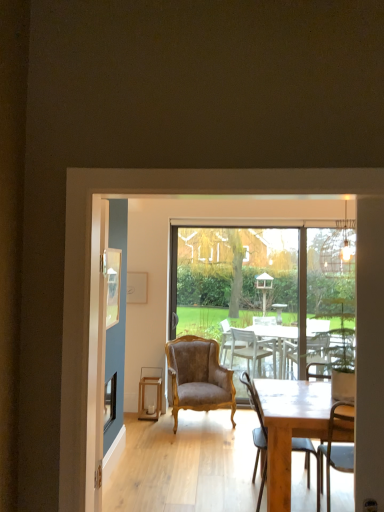
Where is `brown velvet armchair at center, the 2th chair viewed from the right`? The width and height of the screenshot is (384, 512). brown velvet armchair at center, the 2th chair viewed from the right is located at coordinates (198, 377).

The height and width of the screenshot is (512, 384). What do you see at coordinates (266, 290) in the screenshot?
I see `transparent glass window screen at center` at bounding box center [266, 290].

Image resolution: width=384 pixels, height=512 pixels. What do you see at coordinates (145, 389) in the screenshot? I see `wooden stool at center` at bounding box center [145, 389].

The height and width of the screenshot is (512, 384). What do you see at coordinates (112, 284) in the screenshot? I see `wooden picture frame at upper left` at bounding box center [112, 284].

The width and height of the screenshot is (384, 512). I want to click on wooden chair at center, which appears as the 1th chair when viewed from the right, so (x=257, y=431).

I want to click on wooden table at center, so click(x=289, y=428).

Is transparent glass screen door at center aimed at transparent glass window screen at center?

Yes, transparent glass screen door at center is facing transparent glass window screen at center.

Is transparent glass screen door at center wider than transparent glass window screen at center?

No.

Considering the sizes of transparent glass screen door at center and transparent glass window screen at center in the image, is transparent glass screen door at center bigger or smaller than transparent glass window screen at center?

In the image, transparent glass screen door at center appears to be smaller than transparent glass window screen at center.

From the image's perspective, is transparent glass screen door at center over transparent glass window screen at center?

Yes, from the image's perspective, transparent glass screen door at center is on top of transparent glass window screen at center.

Is wooden table at center turned away from transparent glass window screen at center?

That's not correct — wooden table at center is not looking away from transparent glass window screen at center.

Looking at this image, is wooden table at center located outside transparent glass window screen at center?

Yes.

How far apart are wooden table at center and transparent glass window screen at center?

They are 1.42 meters apart.

In the image, is wooden table at center positioned in front of or behind transparent glass window screen at center?

wooden table at center is in front of transparent glass window screen at center.

From the image's perspective, who appears lower, wooden picture frame at upper left or wooden stool at center?

wooden stool at center.

Is wooden picture frame at upper left wider or thinner than wooden stool at center?

Clearly, wooden picture frame at upper left has less width compared to wooden stool at center.

Is point (106, 321) farther from viewer compared to point (154, 368)?

No, (106, 321) is closer to viewer.

What are the coordinates of `picture frame above the wooden stool at center (from a real-world perspective)` in the screenshot? It's located at (112, 284).

Could you tell me if wooden stool at center is facing wooden picture frame at upper left?

No, wooden stool at center is not facing towards wooden picture frame at upper left.

Which of these two, wooden stool at center or wooden picture frame at upper left, is thinner?

wooden picture frame at upper left.

Based on the photo, is wooden picture frame at upper left to the left of brown velvet armchair at center, the 1th chair in the left-to-right sequence, from the viewer's perspective?

Indeed, wooden picture frame at upper left is positioned on the left side of brown velvet armchair at center, the 1th chair in the left-to-right sequence.

Is wooden picture frame at upper left looking in the opposite direction of brown velvet armchair at center, the 2th chair viewed from the right?

wooden picture frame at upper left does not have its back to brown velvet armchair at center, the 2th chair viewed from the right.

From the image's perspective, which is above, wooden picture frame at upper left or brown velvet armchair at center, the 2th chair viewed from the right?

wooden picture frame at upper left, from the image's perspective.

From a real-world perspective, which object rests below the other?

From a 3D spatial view, wooden stool at center is below.

Which of these two, transparent glass window screen at center or wooden stool at center, is thinner?

With smaller width is transparent glass window screen at center.

Between transparent glass window screen at center and wooden stool at center, which one has larger size?

transparent glass window screen at center is bigger.

How many degrees apart are the facing directions of transparent glass window screen at center and wooden stool at center?

1.83 degrees.

Between wooden table at center and wooden stool at center, which one has more height?

With more height is wooden table at center.

Is point (253, 383) farther from camera compared to point (156, 367)?

That is False.

Considering the relative sizes of wooden table at center and wooden stool at center in the image provided, is wooden table at center smaller than wooden stool at center?

Incorrect, wooden table at center is not smaller in size than wooden stool at center.

This screenshot has height=512, width=384. Find the location of `screen door positioned vertically above the transparent glass window screen at center (from a real-world perspective)`. screen door positioned vertically above the transparent glass window screen at center (from a real-world perspective) is located at coordinates (186, 465).

Image resolution: width=384 pixels, height=512 pixels. Find the location of `window screen on the left of wooden table at center`. window screen on the left of wooden table at center is located at coordinates (266, 290).

Which object lies nearer to the anchor point transparent glass screen door at center, wooden chair at center, which appears as the 1th chair when viewed from the right, or brown velvet armchair at center, the 2th chair viewed from the right?

brown velvet armchair at center, the 2th chair viewed from the right, is positioned closer to the anchor transparent glass screen door at center.

When comparing their distances from wooden picture frame at upper left, does wooden stool at center or transparent glass screen door at center seem further?

The object further to wooden picture frame at upper left is wooden stool at center.

Looking at this image, from the image, which object appears to be farther from wooden stool at center, transparent glass window screen at center or brown velvet armchair at center, the 1th chair viewed from the back?

Based on the image, transparent glass window screen at center appears to be further to wooden stool at center.

Estimate the real-world distances between objects in this image. Which object is closer to wooden chair at center, which ranks as the 2th chair in back-to-front order, transparent glass screen door at center or wooden stool at center?

Among the two, transparent glass screen door at center is located nearer to wooden chair at center, which ranks as the 2th chair in back-to-front order.

Considering their positions, is wooden table at center positioned closer to transparent glass window screen at center than wooden stool at center?

The object closer to transparent glass window screen at center is wooden stool at center.

From the image, which object appears to be nearer to wooden chair at center, which ranks as the 2th chair in back-to-front order, brown velvet armchair at center, the 2th chair viewed from the right, or transparent glass screen door at center?

Among the two, transparent glass screen door at center is located nearer to wooden chair at center, which ranks as the 2th chair in back-to-front order.

From the image, which object appears to be nearer to transparent glass window screen at center, wooden chair at center, which appears as the 1th chair when viewed from the right, or brown velvet armchair at center, the 1th chair in the left-to-right sequence?

brown velvet armchair at center, the 1th chair in the left-to-right sequence.

When comparing their distances from transparent glass window screen at center, does transparent glass screen door at center or brown velvet armchair at center, the 1th chair viewed from the back, seem further?

transparent glass screen door at center is further to transparent glass window screen at center.

Locate an element on the screen. This screenshot has width=384, height=512. round table located between transparent glass screen door at center and transparent glass window screen at center in the depth direction is located at coordinates (289, 428).

The width and height of the screenshot is (384, 512). What are the coordinates of `picture frame between wooden chair at center, which is counted as the second chair, starting from the left, and brown velvet armchair at center, the 1th chair in the left-to-right sequence, along the z-axis` in the screenshot? It's located at (112, 284).

Locate an element on the screen. round table between transparent glass screen door at center and wooden chair at center, which ranks as the 2th chair in back-to-front order, from front to back is located at coordinates (289, 428).

I want to click on chair between wooden picture frame at upper left and transparent glass window screen at center along the z-axis, so click(x=198, y=377).